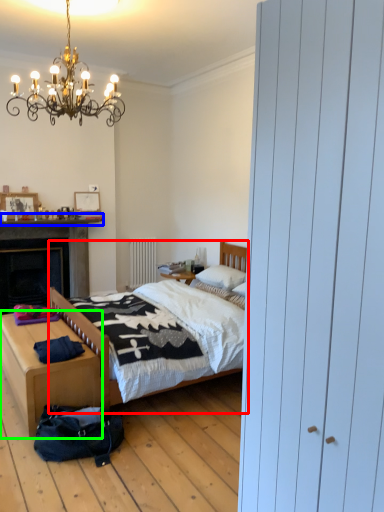
Question: Estimate the real-world distances between objects in this image. Which object is closer to bed (highlighted by a red box), mantle (highlighted by a blue box) or nightstand (highlighted by a green box)?

Choices:
 (A) mantle
 (B) nightstand

Answer: (B)